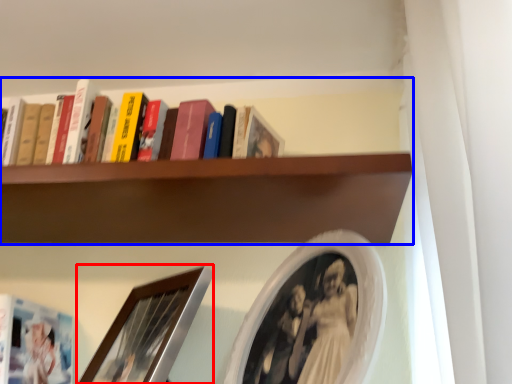
Question: Which of the following is the closest to the observer, picture frame (highlighted by a red box) or shelf (highlighted by a blue box)?

Choices:
 (A) picture frame
 (B) shelf

Answer: (A)